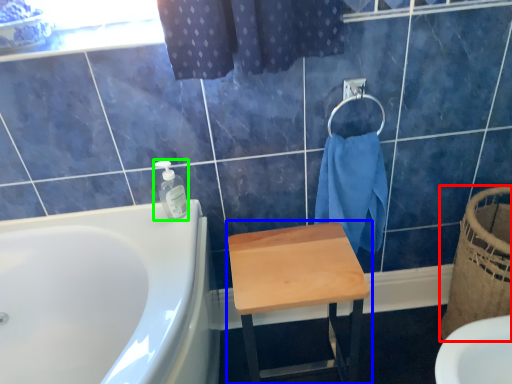
Question: Which object is the farthest from basket (highlighted by a red box)? Choose among these: stool (highlighted by a blue box) or soap dispenser (highlighted by a green box).

Choices:
 (A) stool
 (B) soap dispenser

Answer: (B)